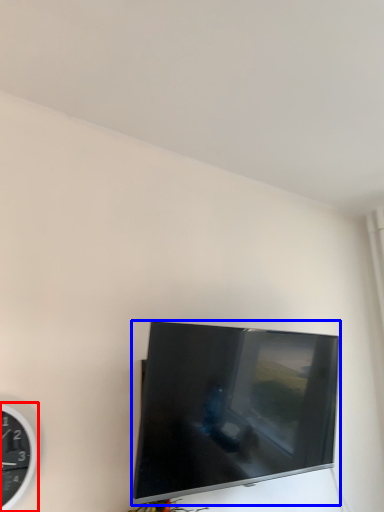
Question: Among these objects, which one is farthest to the camera, wall clock (highlighted by a red box) or television (highlighted by a blue box)?

Choices:
 (A) wall clock
 (B) television

Answer: (B)